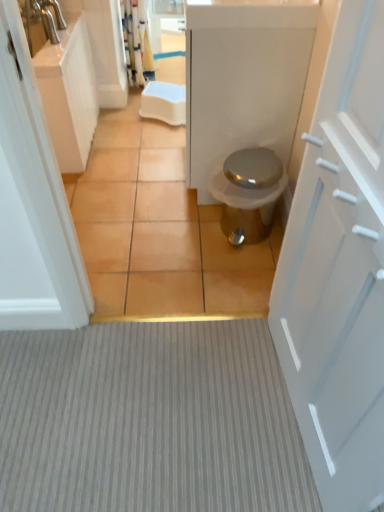
Question: Is white matte door at right to the left of gray textured carpet at center from the viewer's perspective?

Choices:
 (A) yes
 (B) no

Answer: (B)

Question: Can you confirm if white matte door at right is wider than gray textured carpet at center?

Choices:
 (A) yes
 (B) no

Answer: (B)

Question: From a real-world perspective, is white matte door at right located beneath gray textured carpet at center?

Choices:
 (A) no
 (B) yes

Answer: (A)

Question: Is white matte door at right turned away from gray textured carpet at center?

Choices:
 (A) yes
 (B) no

Answer: (B)

Question: Does white matte door at right have a larger size compared to gray textured carpet at center?

Choices:
 (A) no
 (B) yes

Answer: (B)

Question: Does white matte door at right have a lesser width compared to gray textured carpet at center?

Choices:
 (A) no
 (B) yes

Answer: (B)

Question: Would you say satin silver trash can at center contains white glossy counter top at upper center?

Choices:
 (A) yes
 (B) no

Answer: (B)

Question: Is satin silver trash can at center far away from white glossy counter top at upper center?

Choices:
 (A) yes
 (B) no

Answer: (B)

Question: Is satin silver trash can at center smaller than white glossy counter top at upper center?

Choices:
 (A) yes
 (B) no

Answer: (B)

Question: Is satin silver trash can at center to the left of white glossy counter top at upper center from the viewer's perspective?

Choices:
 (A) yes
 (B) no

Answer: (B)

Question: From a real-world perspective, is satin silver trash can at center beneath white glossy counter top at upper center?

Choices:
 (A) yes
 (B) no

Answer: (A)

Question: From the image's perspective, is satin silver trash can at center located above white glossy counter top at upper center?

Choices:
 (A) yes
 (B) no

Answer: (B)

Question: Is there a large distance between brown tile at center and white matte door at right?

Choices:
 (A) no
 (B) yes

Answer: (A)